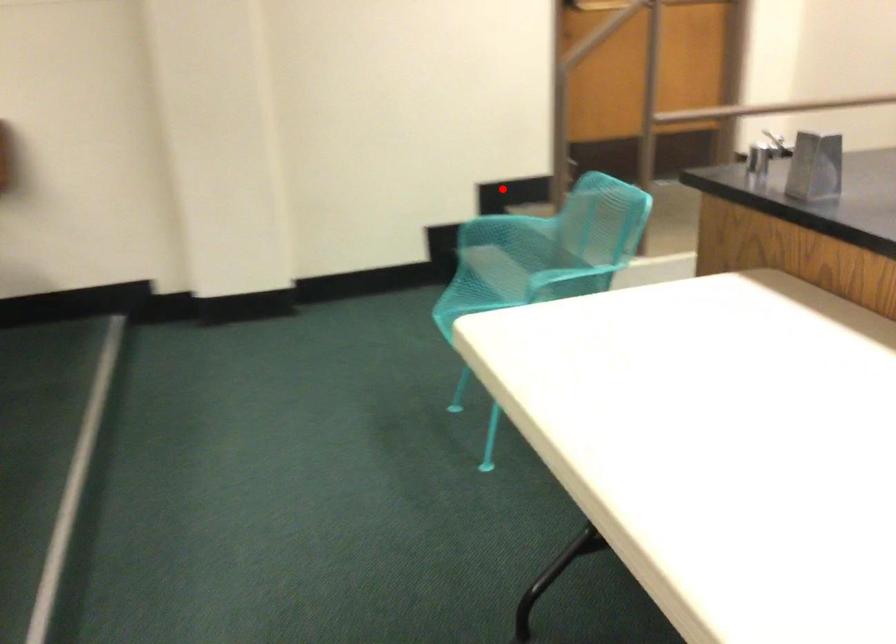
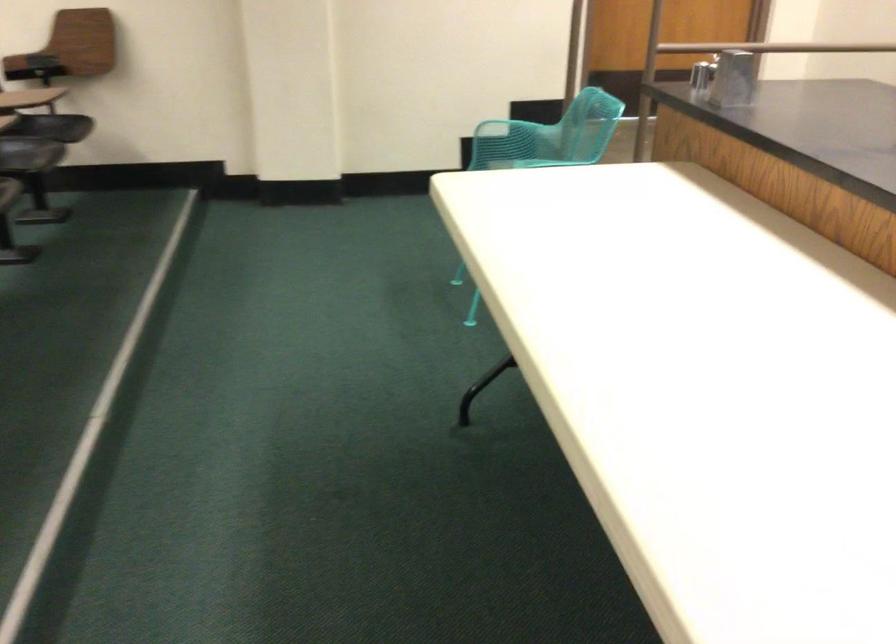
In the second image, find the point that corresponds to the highlighted location in the first image.

(533, 111)